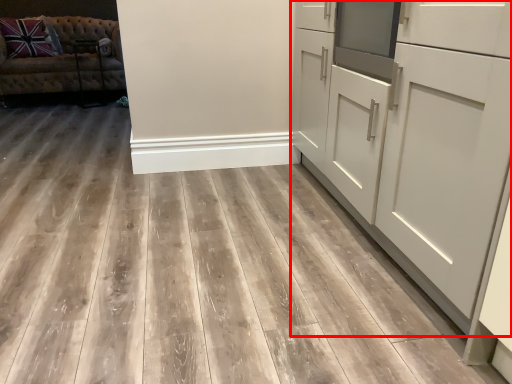
Question: From the image's perspective, considering the relative positions of cabinetry (annotated by the red box) and studio couch in the image provided, where is cabinetry (annotated by the red box) located with respect to the staircase?

Choices:
 (A) above
 (B) below

Answer: (B)